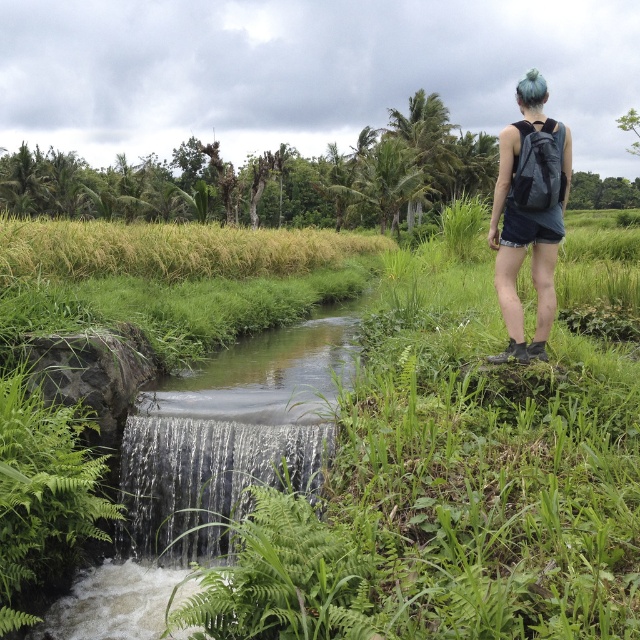
Who is shorter, green grass at upper left or clear water cascade at lower left?

With less height is clear water cascade at lower left.

Can you confirm if green grass at upper left is thinner than clear water cascade at lower left?

No, green grass at upper left is not thinner than clear water cascade at lower left.

Does point (458, 138) come in front of point (156, 426)?

No, it is not.

Locate an element on the screen. green grass at upper left is located at coordinates (269, 179).

Is clear water cascade at lower left taller than matte gray backpack at upper right?

Incorrect, clear water cascade at lower left's height is not larger of matte gray backpack at upper right's.

Between clear water cascade at lower left and matte gray backpack at upper right, which one is positioned lower?

clear water cascade at lower left

Who is more distant from viewer, (128, 442) or (525, 234)?

The point (128, 442) is more distant.

Image resolution: width=640 pixels, height=640 pixels. In order to click on clear water cascade at lower left in this screenshot , I will do `click(205, 480)`.

How far apart are green grass at upper left and matte gray backpack at upper right?

green grass at upper left is 47.10 meters away from matte gray backpack at upper right.

Is point (198, 154) positioned in front of point (524, 134)?

That is False.

Image resolution: width=640 pixels, height=640 pixels. I want to click on green grass at upper left, so click(269, 179).